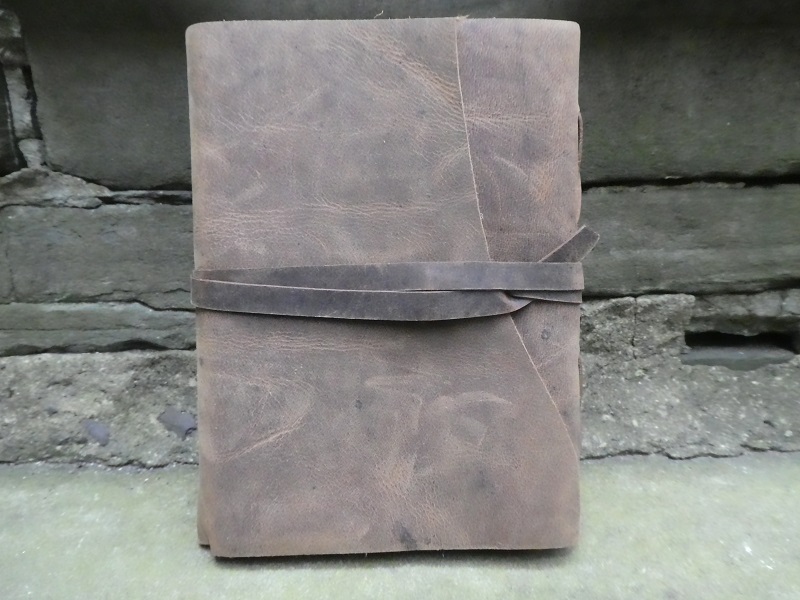
This screenshot has height=600, width=800. I want to click on leatherbound book, so click(x=450, y=448).